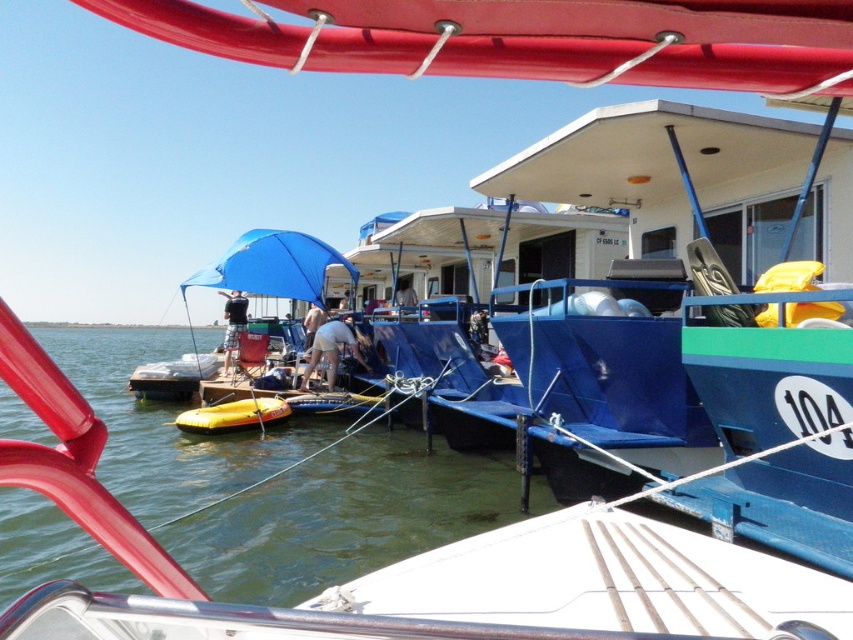
Question: Does green water at lower left have a lesser width compared to blue fabric umbrella at left?

Choices:
 (A) no
 (B) yes

Answer: (A)

Question: Does green water at lower left have a smaller size compared to blue fabric umbrella at left?

Choices:
 (A) no
 (B) yes

Answer: (A)

Question: Which of the following is the closest to the observer?

Choices:
 (A) blue fabric umbrella at left
 (B) green water at lower left

Answer: (B)

Question: Considering the relative positions of green water at lower left and blue fabric umbrella at left in the image provided, where is green water at lower left located with respect to blue fabric umbrella at left?

Choices:
 (A) right
 (B) left

Answer: (B)

Question: Which of the following is the farthest from the observer?

Choices:
 (A) green water at lower left
 (B) blue fabric umbrella at left

Answer: (B)

Question: Which point is farther from the camera taking this photo?

Choices:
 (A) (32, 548)
 (B) (248, 260)

Answer: (B)